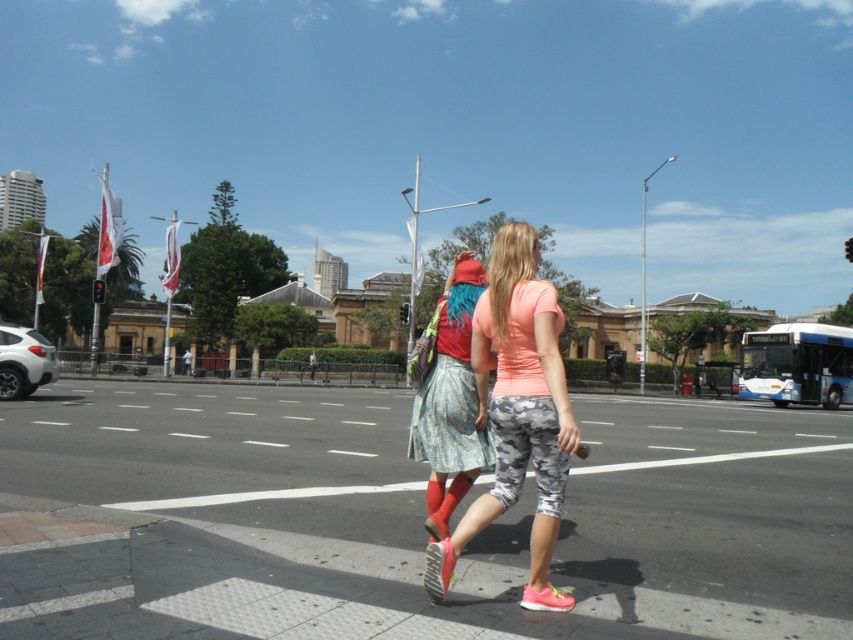
In the scene shown: You are a photographer trying to capture both the camouflage leggings at center and the floral skirt at center in the same frame. Given that your camera has a minimum focus distance of 20 inches, will you be able to focus on both subjects simultaneously?

The camouflage leggings at center and floral skirt at center are 21.74 inches apart. Since the distance between them is greater than the camera minimum focus distance of 20 inches, the photographer can focus on both subjects simultaneously.

You are a fashion designer observing the pedestrians at the crosswalk. You need to determine if a new pair of pants with a width of 40 cm would fit someone wearing the camouflage leggings at center and the floral skirt at center. Which person would the pants fit better?

The camouflage leggings at center has a larger width than the floral skirt at center. The new pants with a width of 40 cm would fit better on the person wearing the camouflage leggings at center if their current leggings are narrower than 40 cm, but this requires knowing the exact width of their current leggings. Alternatively, if comparing directly, since the camouflage leggings are wider, the 40 cm pants might be more suitable for the floral skirt wearer if their skirt is narrower, but the description is